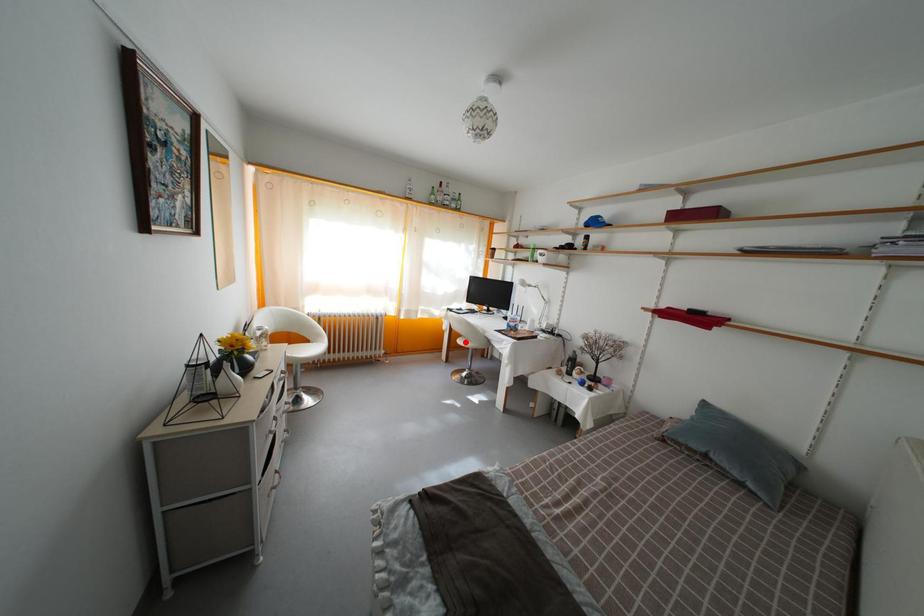
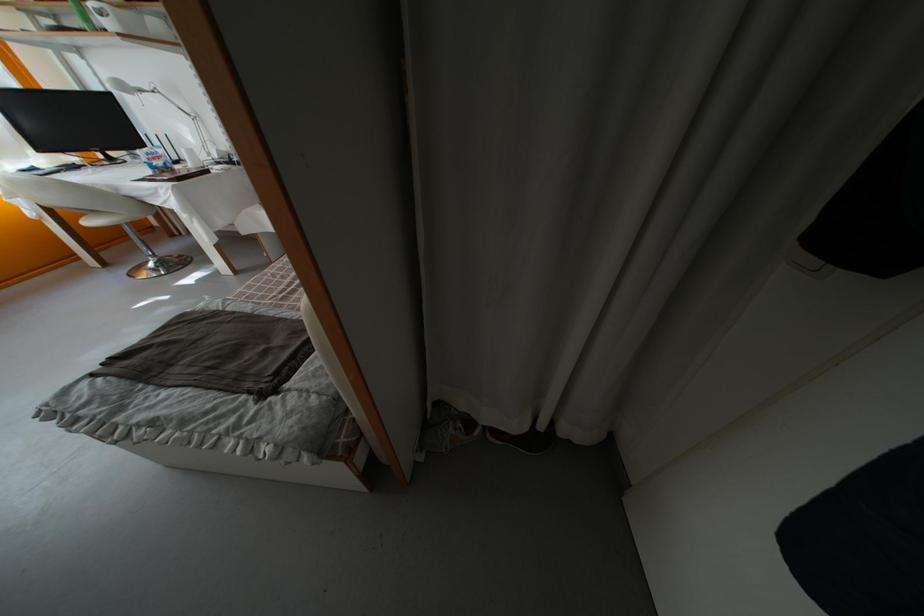
Question: I am providing you with two images of the same scene from different viewpoints. Given a red point in image1, look at the same physical point in image2. Is it:

Choices:
 (A) Closer to the viewpoint
 (B) Farther from the viewpoint

Answer: (B)